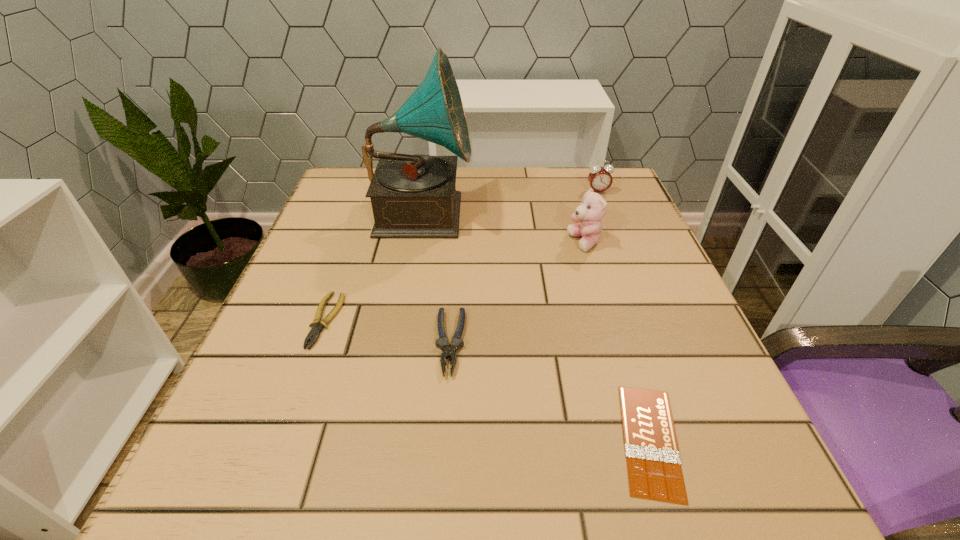
The image size is (960, 540). What are the coordinates of `vacant space at the right edge` in the screenshot? It's located at (636, 364).

In the image, there is a desktop. At what (x,y) coordinates should I click in order to perform the action: click on vacant space at the far left corner. Please return your answer as a coordinate pair (x, y). Looking at the image, I should click on (346, 210).

What are the coordinates of `blank space at the near left corner` in the screenshot? It's located at (183, 504).

Where is `vacant region at the far right corner of the desktop`? The width and height of the screenshot is (960, 540). vacant region at the far right corner of the desktop is located at coordinates (624, 193).

Locate an element on the screen. blank space at the near right corner of the desktop is located at coordinates (741, 460).

Locate an element on the screen. This screenshot has height=540, width=960. vacant area that lies between the taller pliers and the shortest object is located at coordinates (550, 392).

You are a GUI agent. You are given a task and a screenshot of the screen. Output one action in this format:
    pyautogui.click(x=<x>, y=<y>)
    Task: Click on the free space between the alarm clock and the right pliers
    The height and width of the screenshot is (540, 960).
    Given the screenshot: What is the action you would take?
    pyautogui.click(x=524, y=267)

Where is `vacant area that lies between the nearest object and the shorter pliers`? vacant area that lies between the nearest object and the shorter pliers is located at coordinates (488, 381).

Where is `free area in between the nearest object and the tallest object`? free area in between the nearest object and the tallest object is located at coordinates pos(537,326).

Locate an element on the screen. The image size is (960, 540). vacant area between the taller pliers and the left pliers is located at coordinates tap(388, 332).